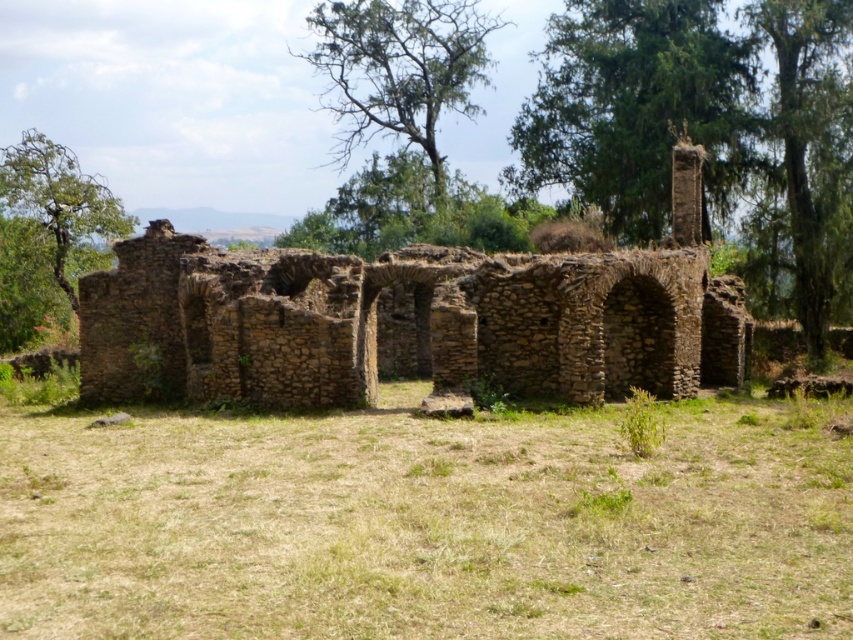
You are standing at the point marked as point (410, 320) in the image. Based on the scene description, what type of terrain are you currently standing on?

You are standing on brown stone ruins at center, which are part of the ancient stone structure ruins described in the scene.

You are standing at the base of the ancient stone ruins and want to place a small flag at the point closer to you between point (572, 124) and point (744, 4). Which point should you choose?

You should choose point (572, 124) because it is closer to you than point (744, 4).